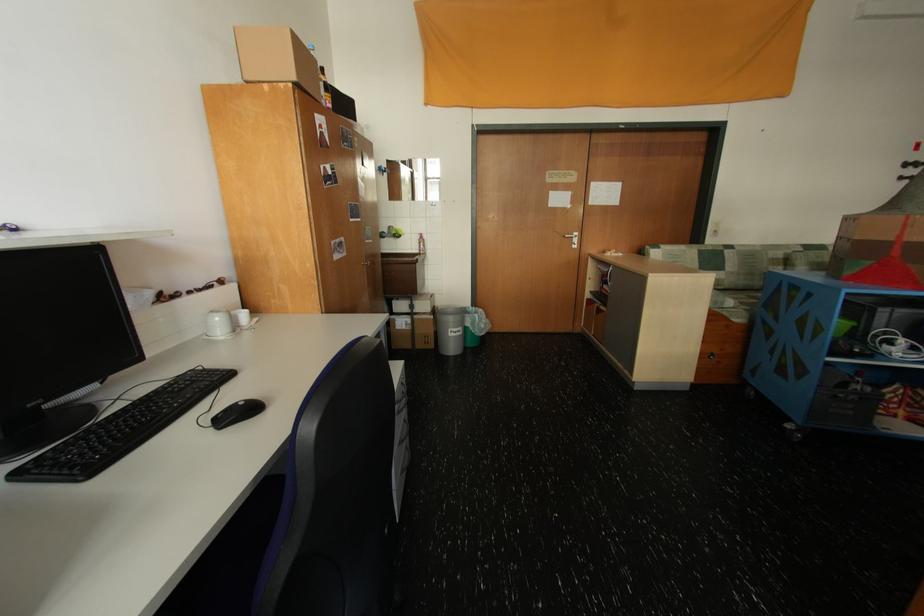
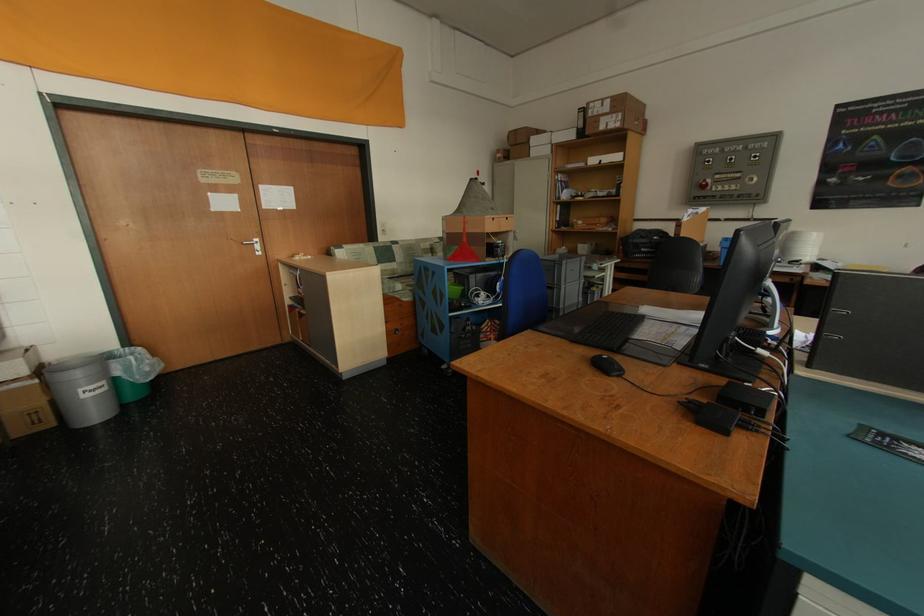
The point at [464,334] is marked in the first image. Where is the corresponding point in the second image?

(101, 392)